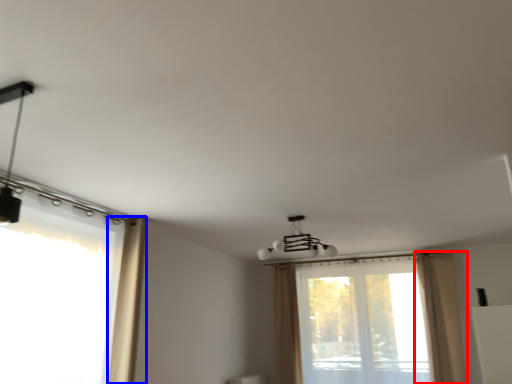
Question: Which of the following is the farthest to the observer, curtain (highlighted by a red box) or curtain (highlighted by a blue box)?

Choices:
 (A) curtain
 (B) curtain

Answer: (A)